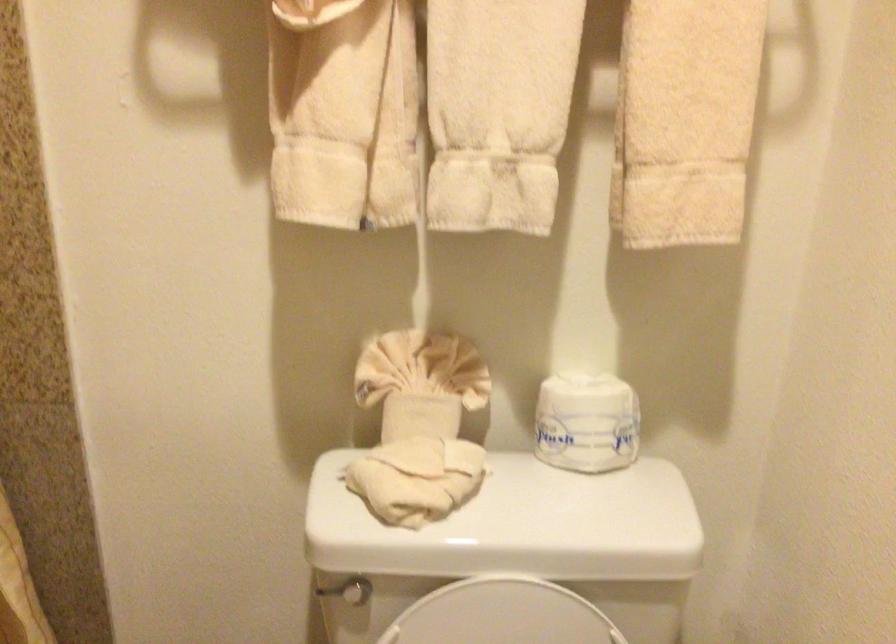
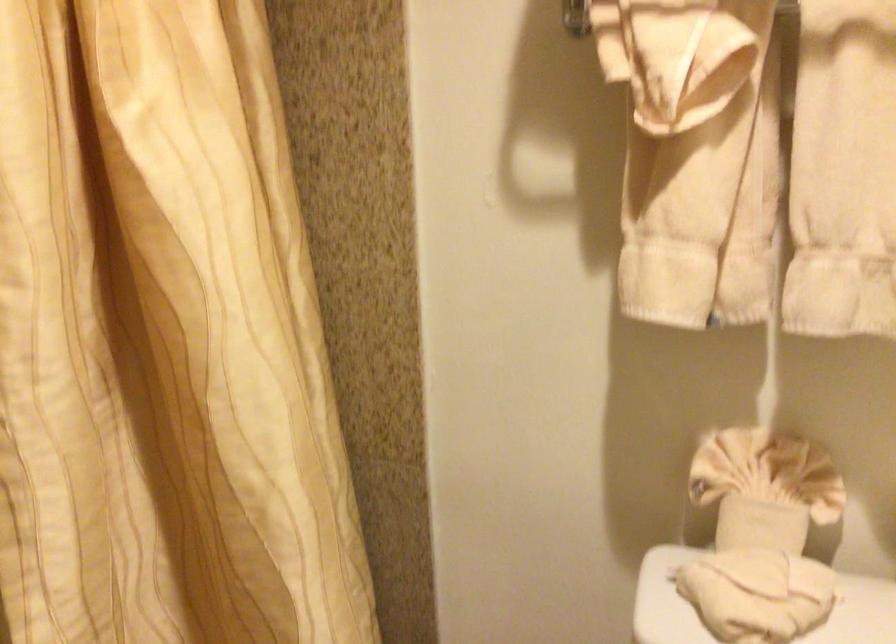
Question: The camera is either moving clockwise (left) or counter-clockwise (right) around the object. The first image is from the beginning of the video and the second image is from the end. Is the camera moving left or right when shooting the video?

Choices:
 (A) Left
 (B) Right

Answer: (B)